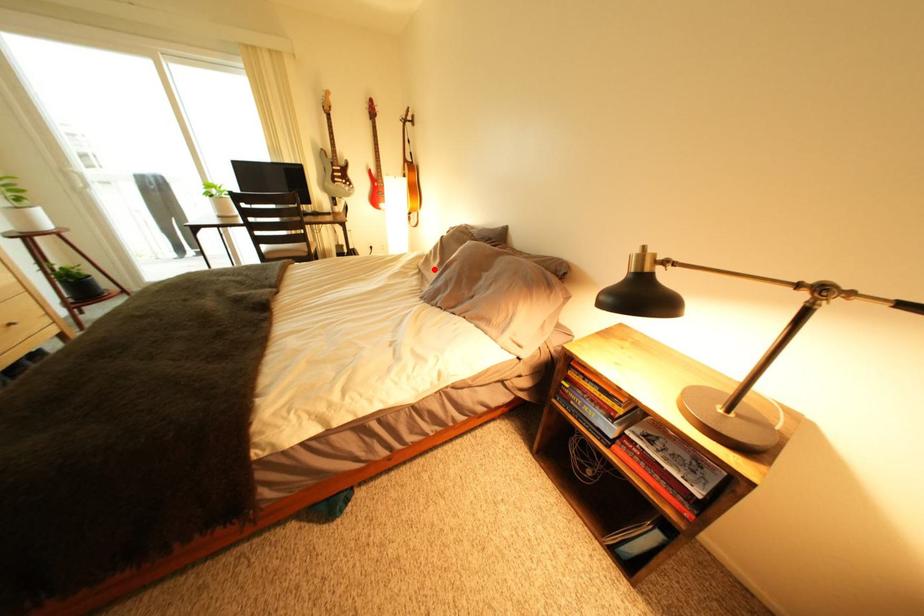
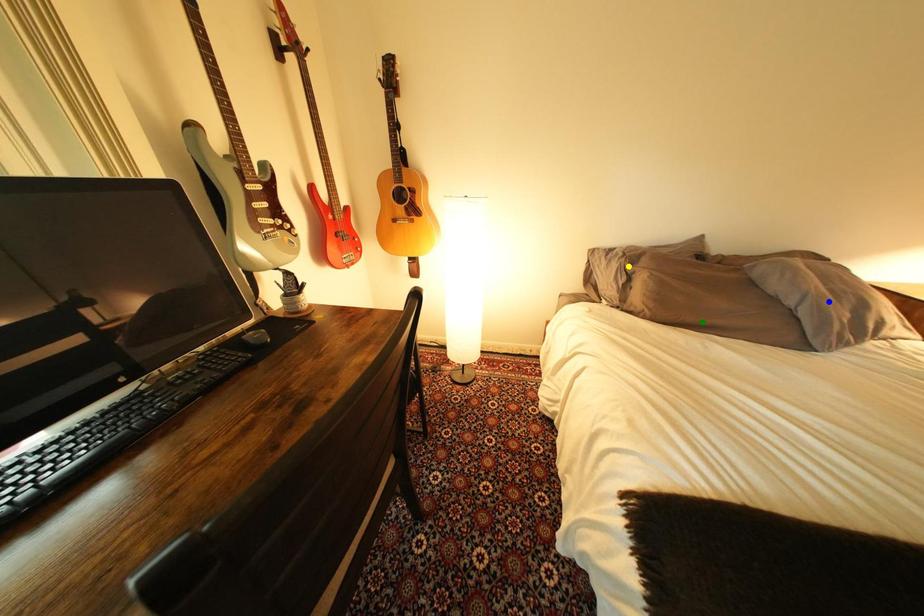
Question: I am providing you with two images of the same scene from different viewpoints. A red point is marked on the first image. You are given multiple points on the second image. Which mark in image 2 goes with the point in image 1?

Choices:
 (A) yellow point
 (B) green point
 (C) blue point

Answer: (B)